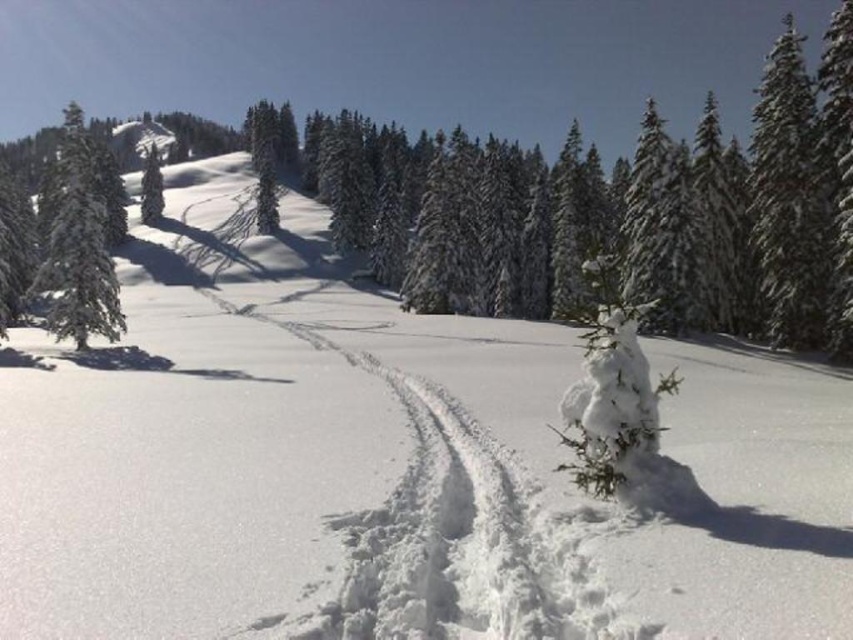
Is snow-covered evergreen tree at upper center taller than green snow-covered tree at left?

In fact, snow-covered evergreen tree at upper center may be shorter than green snow-covered tree at left.

Which is in front, point (843, 205) or point (68, 289)?

Point (843, 205)

Locate an element on the screen. snow-covered evergreen tree at upper center is located at coordinates [643, 212].

Image resolution: width=853 pixels, height=640 pixels. Describe the element at coordinates (610, 388) in the screenshot. I see `white fluffy tree at center-right` at that location.

Who is higher up, white fluffy tree at center-right or green snow-covered tree at left?

green snow-covered tree at left

Who is more forward, (621, 385) or (97, 259)?

Point (621, 385) is more forward.

Locate an element on the screen. white fluffy tree at center-right is located at coordinates (x=610, y=388).

Who is lower down, snow-covered evergreen tree at upper center or white fluffy tree at center-right?

white fluffy tree at center-right is lower down.

Does snow-covered evergreen tree at upper center have a greater height compared to white fluffy tree at center-right?

Yes.

At what (x,y) coordinates should I click in order to perform the action: click on snow-covered evergreen tree at upper center. Please return your answer as a coordinate pair (x, y). This screenshot has width=853, height=640. Looking at the image, I should click on [x=643, y=212].

Find the location of a particular element. The width and height of the screenshot is (853, 640). snow-covered evergreen tree at upper center is located at coordinates (643, 212).